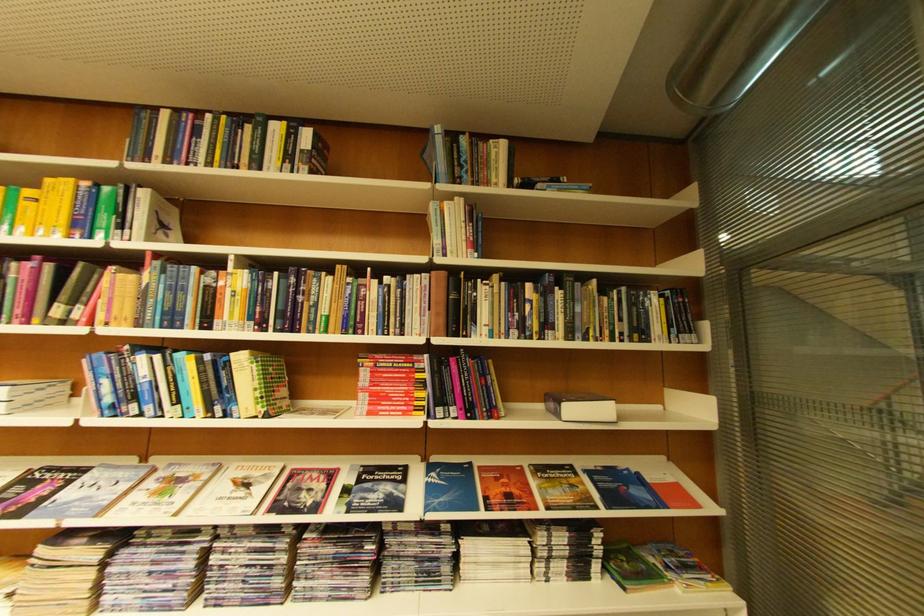
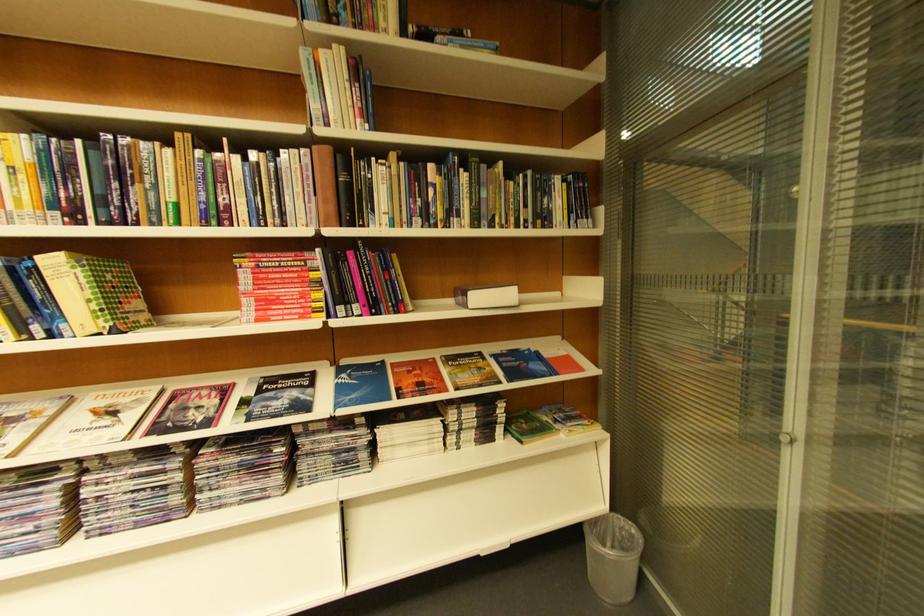
Locate, in the second image, the point that corresponds to [333,472] in the first image.

(224, 389)